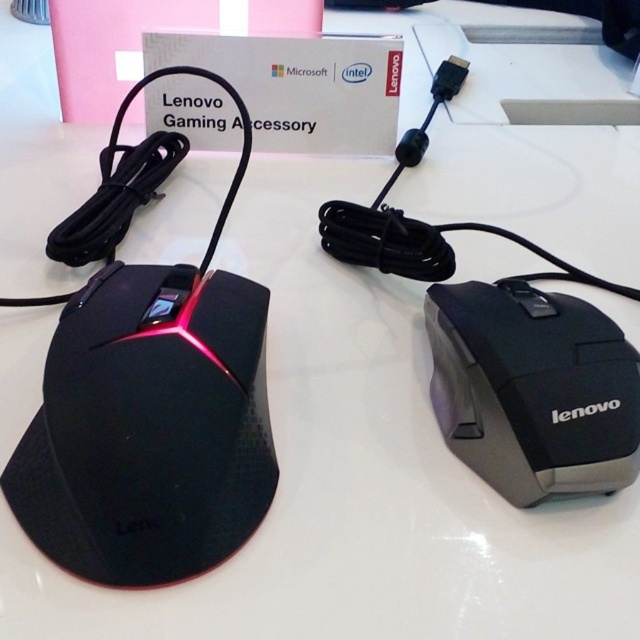
Which is below, matte black mouse at left or black matte mouse at right?

Positioned lower is matte black mouse at left.

Does matte black mouse at left appear on the right side of black matte mouse at right?

In fact, matte black mouse at left is to the left of black matte mouse at right.

The height and width of the screenshot is (640, 640). What do you see at coordinates (148, 429) in the screenshot?
I see `matte black mouse at left` at bounding box center [148, 429].

The width and height of the screenshot is (640, 640). Identify the location of matte black mouse at left. (148, 429).